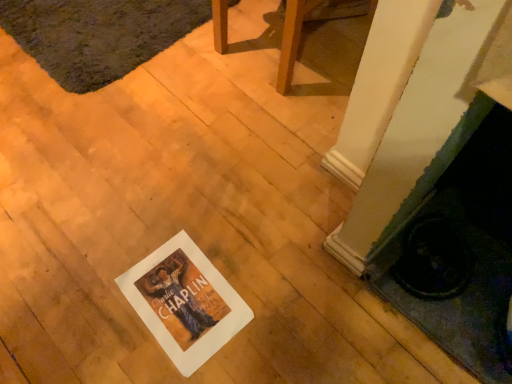
What are the coordinates of `vacant area that lies between dark gray shaggy rug at upper left and white paper at center` in the screenshot? It's located at (153, 140).